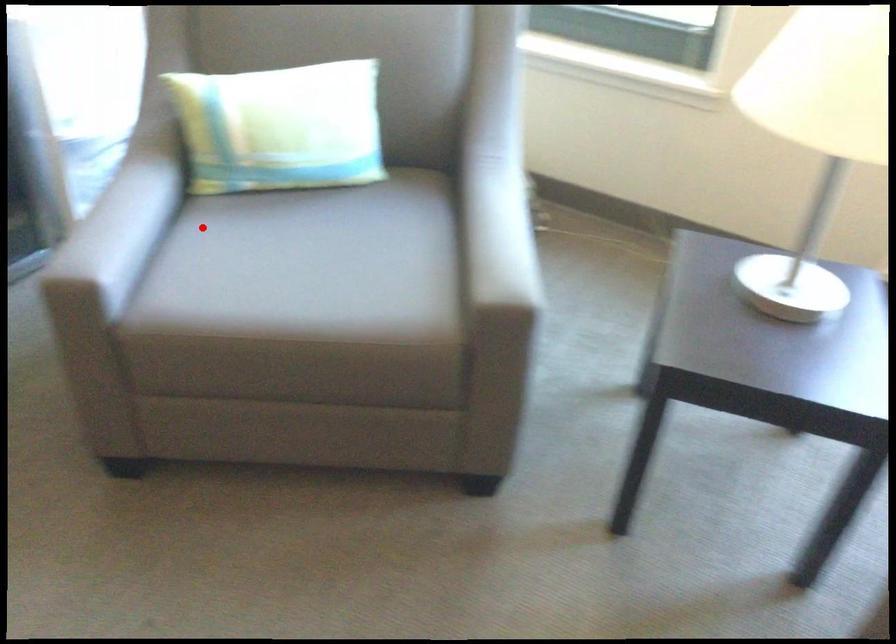
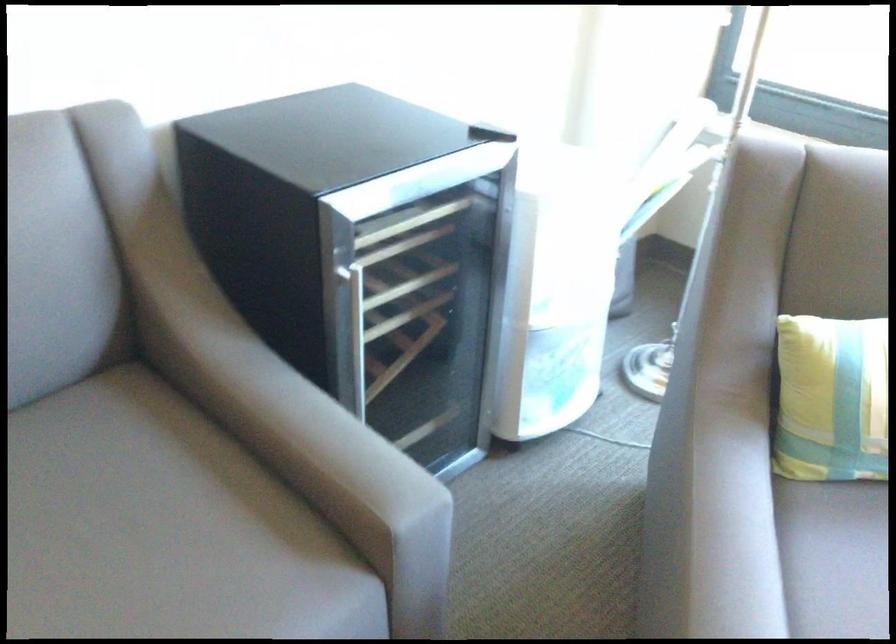
Question: I am providing you with two images of the same scene from different viewpoints. Image1 has a red point marked. In image2, the corresponding 3D location appears at what relative position? Reply with the corresponding letter.

Choices:
 (A) Closer
 (B) Farther

Answer: (A)